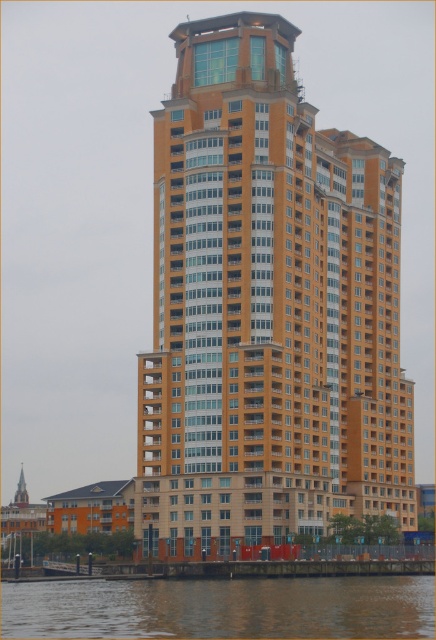
You are standing at the origin point of the coordinate system. The orange glassy building at center is at coordinates approximately 0.483 on the x and 0.612 on the y. If you want to move directly towards the building, which direction should you head in?

The orange glassy building at center is located at coordinates approximately 0.483 on the x and 0.612 on the y. Since the coordinates are positive in both x and y directions, you should move northeast to reach it.

In the scene shown: You are standing at the base of the highrise building and notice two points marked on the facade. The first point is located at coordinates point (153, 490) and the second at point (197, 582). Which point is closer to the viewer?

Point (197, 582) is closer to the viewer because point (153, 490) is behind it.

You are a construction worker assessing the safety of the orange glassy building at center and the brown water at lower center. Which object is positioned higher in the scene?

The orange glassy building at center is located above brown water at lower center, so it is positioned higher in the scene.